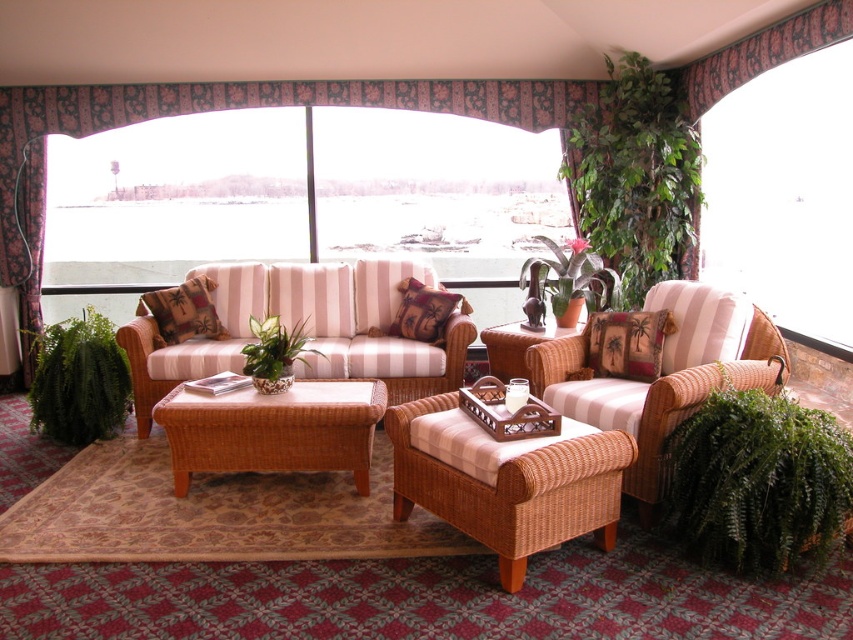
Question: Which point is closer to the camera?

Choices:
 (A) green glossy plant at center
 (B) green leafy plant at upper right
 (C) pink floral fabric curtain at upper center
 (D) green leafy plant at lower right

Answer: (D)

Question: Is striped fabric couch at center in front of palm-patterned fabric cushion at right?

Choices:
 (A) no
 (B) yes

Answer: (A)

Question: Observing the image, what is the correct spatial positioning of striped fabric couch at center in reference to green leafy plant at lower left?

Choices:
 (A) right
 (B) left

Answer: (A)

Question: Is matte wicker armchair at center positioned at the back of woven rattan coffee table at center?

Choices:
 (A) no
 (B) yes

Answer: (A)

Question: Which object appears farthest from the camera in this image?

Choices:
 (A) palm-patterned fabric cushion at right
 (B) palm-patterned fabric pillow at center

Answer: (B)

Question: Among these points, which one is nearest to the camera?

Choices:
 (A) (647, 472)
 (B) (824, 128)
 (C) (585, 260)

Answer: (A)